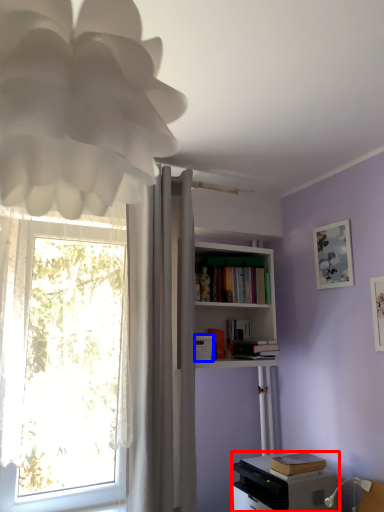
Question: Which object is further to the camera taking this photo, printer (highlighted by a red box) or appliance (highlighted by a blue box)?

Choices:
 (A) printer
 (B) appliance

Answer: (B)